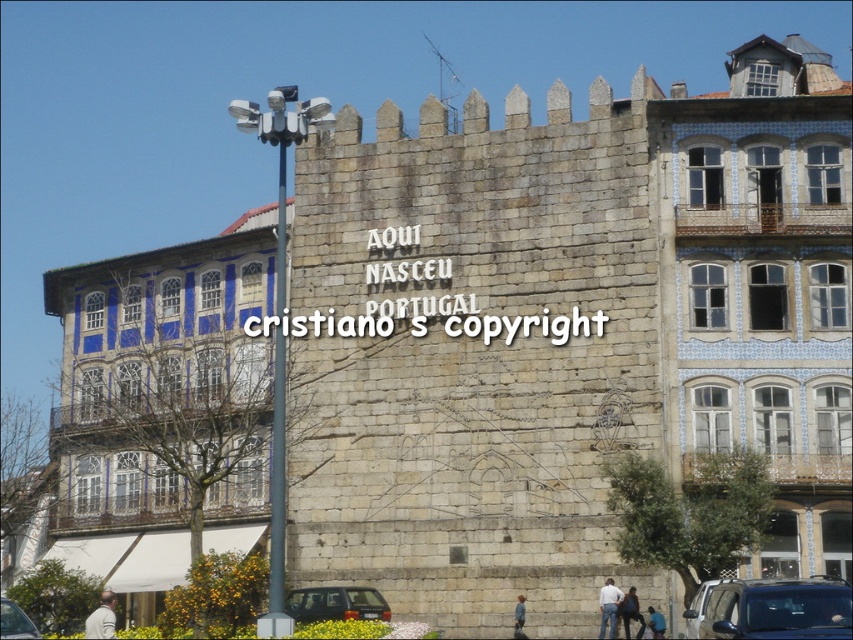
Is metallic silver car at lower right below light blue fabric at center?

Actually, metallic silver car at lower right is above light blue fabric at center.

Measure the distance from metallic silver car at lower right to light blue fabric at center.

metallic silver car at lower right is 13.41 meters from light blue fabric at center.

Does point (705, 634) lie in front of point (521, 625)?

Yes.

The width and height of the screenshot is (853, 640). Identify the location of metallic silver car at lower right. (776, 609).

Describe the element at coordinates (608, 609) in the screenshot. I see `white cotton shirt at center` at that location.

Where is `white cotton shirt at center`? This screenshot has height=640, width=853. white cotton shirt at center is located at coordinates (608, 609).

Is metallic silver car at lower right to the right of light beige fabric jacket at lower left from the viewer's perspective?

Yes, metallic silver car at lower right is to the right of light beige fabric jacket at lower left.

You are a GUI agent. You are given a task and a screenshot of the screen. Output one action in this format:
    pyautogui.click(x=<x>, y=<y>)
    Task: Click on the metallic silver car at lower right
    Image resolution: width=853 pixels, height=640 pixels.
    Given the screenshot: What is the action you would take?
    pyautogui.click(x=776, y=609)

Which is behind, point (728, 609) or point (94, 620)?

The point (94, 620) is more distant.

Image resolution: width=853 pixels, height=640 pixels. What are the coordinates of `metallic silver car at lower right` in the screenshot? It's located at (776, 609).